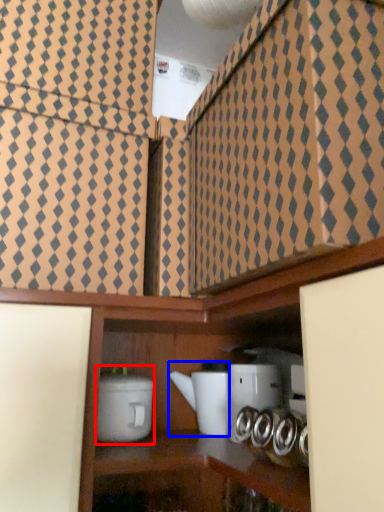
Question: Which point is closer to the camera, appliance (highlighted by a red box) or appliance (highlighted by a blue box)?

Choices:
 (A) appliance
 (B) appliance

Answer: (A)